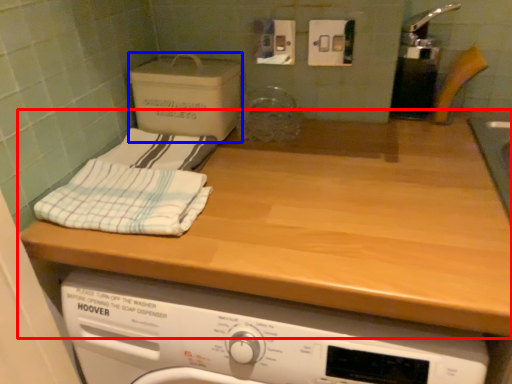
Question: Which object is closer to the camera taking this photo, countertop (highlighted by a red box) or cardboard box (highlighted by a blue box)?

Choices:
 (A) countertop
 (B) cardboard box

Answer: (A)